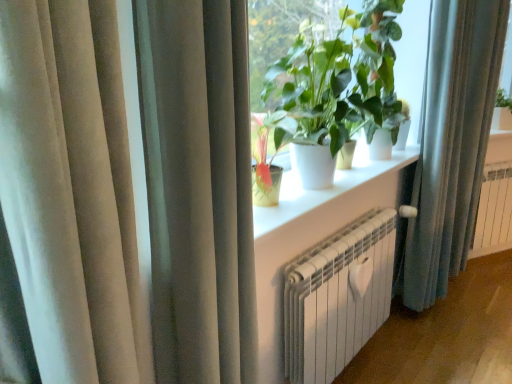
Image resolution: width=512 pixels, height=384 pixels. I want to click on free space above white matte window sill at center (from a real-world perspective), so click(338, 182).